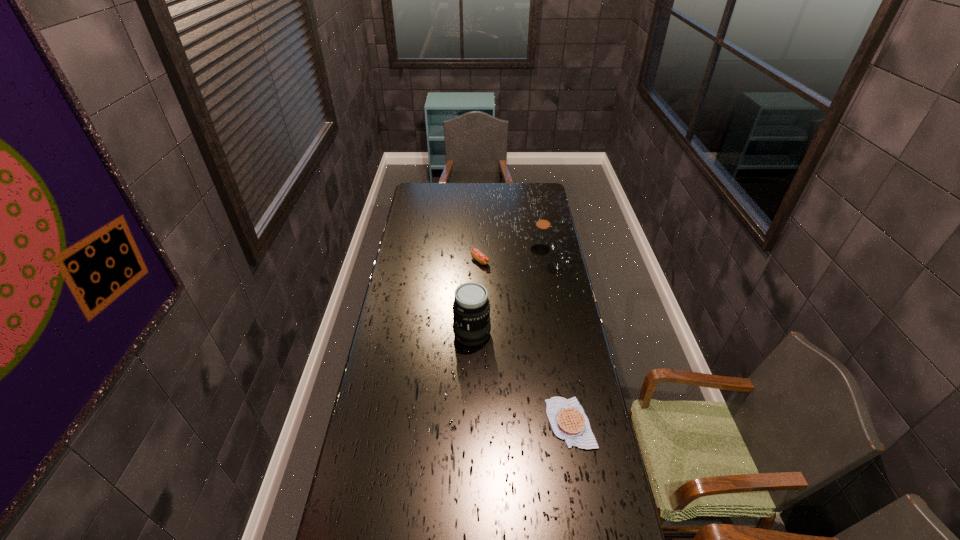
Locate an element on the screen. The width and height of the screenshot is (960, 540). telephoto lens is located at coordinates (471, 309).

I want to click on the tallest object, so click(471, 309).

The image size is (960, 540). I want to click on jar, so click(x=541, y=239).

This screenshot has height=540, width=960. Find the location of `the second shortest object`. the second shortest object is located at coordinates (475, 253).

You are a GUI agent. You are given a task and a screenshot of the screen. Output one action in this format:
    pyautogui.click(x=<x>, y=<y>)
    Task: Click on the pie
    The image size is (960, 540).
    Given the screenshot: What is the action you would take?
    pyautogui.click(x=567, y=418)

Where is `the shortest object`? the shortest object is located at coordinates (567, 418).

Identify the location of vacant position located 0.180m on the right of the tallest object. Image resolution: width=960 pixels, height=540 pixels. (535, 333).

At what (x,y) coordinates should I click in order to perform the action: click on vacant space located on the left of the third shortest object. Please return your answer as a coordinate pair (x, y). Image resolution: width=960 pixels, height=540 pixels. Looking at the image, I should click on (504, 250).

Identify the location of free location located 0.120m on the back of the third tallest object. (480, 240).

The height and width of the screenshot is (540, 960). I want to click on vacant space located 0.060m on the back of the shortest object, so click(564, 383).